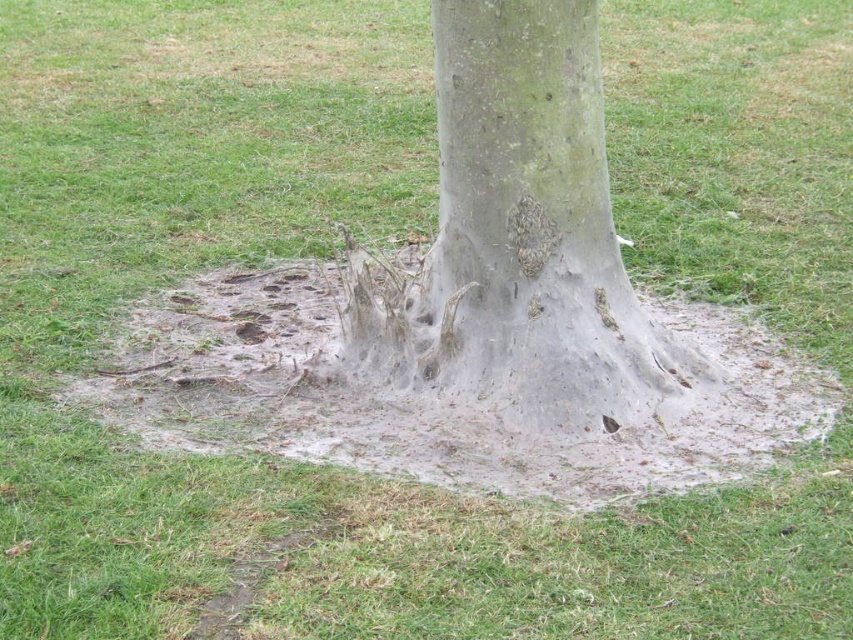
Question: Which point is farther to the camera?

Choices:
 (A) white sandy mud at center
 (B) gray rough bark at center

Answer: (B)

Question: Does white sandy mud at center have a lesser width compared to gray rough bark at center?

Choices:
 (A) no
 (B) yes

Answer: (A)

Question: Which point is farther to the camera?

Choices:
 (A) white sandy mud at center
 (B) gray rough bark at center

Answer: (B)

Question: Observing the image, what is the correct spatial positioning of white sandy mud at center in reference to gray rough bark at center?

Choices:
 (A) left
 (B) right

Answer: (A)

Question: Which point appears closest to the camera in this image?

Choices:
 (A) (596, 90)
 (B) (299, 356)

Answer: (A)

Question: Can you confirm if white sandy mud at center is positioned below gray rough bark at center?

Choices:
 (A) no
 (B) yes

Answer: (B)